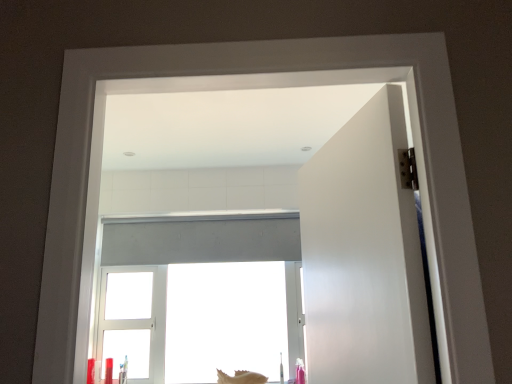
Find the location of a particular element. smooth beige seashell at lower center is located at coordinates (241, 377).

Describe the element at coordinates (365, 254) in the screenshot. I see `white matte door at right` at that location.

The image size is (512, 384). Find the location of `smooth beige seashell at lower center`. smooth beige seashell at lower center is located at coordinates (241, 377).

Is white matte window at center positioned far away from white matte door at right?

Yes, white matte window at center and white matte door at right are located far from each other.

From a real-world perspective, is white matte window at center located beneath white matte door at right?

Indeed, from a real-world perspective, white matte window at center is positioned beneath white matte door at right.

Which of these two, white matte window at center or white matte door at right, is wider?

white matte door at right is wider.

From the image's perspective, which is below, white matte window at center or white matte door at right?

white matte window at center.

Could you tell me if white matte door at right is turned towards white matte window at center?

No, white matte door at right does not turn towards white matte window at center.

Can you confirm if white matte door at right is bigger than white matte window at center?

Actually, white matte door at right might be smaller than white matte window at center.

The width and height of the screenshot is (512, 384). Identify the location of window below the white matte door at right (from a real-world perspective). (201, 239).

Which object is wider, white matte door at right or white matte window at center?

white matte door at right.

Consider the image. Who is more distant, white matte window at center or smooth beige seashell at lower center?

white matte window at center.

Can you confirm if white matte window at center is smaller than smooth beige seashell at lower center?

No, white matte window at center is not smaller than smooth beige seashell at lower center.

From the image's perspective, would you say white matte window at center is shown under smooth beige seashell at lower center?

No.

Is white matte door at right touching smooth beige seashell at lower center?

white matte door at right and smooth beige seashell at lower center are not in contact.

Could you tell me if white matte door at right is turned towards smooth beige seashell at lower center?

No.

Is smooth beige seashell at lower center located within white matte door at right?

No.

Is smooth beige seashell at lower center positioned beyond the bounds of white matte door at right?

Absolutely, smooth beige seashell at lower center is external to white matte door at right.

From the image's perspective, is smooth beige seashell at lower center located above white matte door at right?

No, from the image's perspective, smooth beige seashell at lower center is not above white matte door at right.

Considering the relative sizes of smooth beige seashell at lower center and white matte door at right in the image provided, is smooth beige seashell at lower center thinner than white matte door at right?

Yes, smooth beige seashell at lower center is thinner than white matte door at right.

From a real-world perspective, is smooth beige seashell at lower center over white matte door at right?

Actually, smooth beige seashell at lower center is physically below white matte door at right in the real world.

Are smooth beige seashell at lower center and white matte window at center making contact?

No, smooth beige seashell at lower center is not making contact with white matte window at center.

Does smooth beige seashell at lower center have a greater width compared to white matte window at center?

No, smooth beige seashell at lower center is not wider than white matte window at center.

Is smooth beige seashell at lower center positioned with its back to white matte window at center?

Yes.

What's the angular difference between smooth beige seashell at lower center and white matte window at center's facing directions?

smooth beige seashell at lower center and white matte window at center are facing 6.14 degrees away from each other.

You are a GUI agent. You are given a task and a screenshot of the screen. Output one action in this format:
    pyautogui.click(x=<x>, y=<y>)
    Task: Click on the door on the right side of white matte window at center
    Image resolution: width=512 pixels, height=384 pixels.
    Given the screenshot: What is the action you would take?
    pyautogui.click(x=365, y=254)

Identify the location of window behind the white matte door at right. Image resolution: width=512 pixels, height=384 pixels. click(x=201, y=239).

Based on their spatial positions, is white matte window at center or smooth beige seashell at lower center further from white matte door at right?

smooth beige seashell at lower center is further to white matte door at right.

Looking at the image, which one is located further to white matte window at center, white matte door at right or smooth beige seashell at lower center?

white matte door at right.

In the scene shown: Based on their spatial positions, is white matte window at center or white matte door at right further from smooth beige seashell at lower center?

white matte door at right is positioned further to the anchor smooth beige seashell at lower center.

Which object lies nearer to the anchor point smooth beige seashell at lower center, white matte door at right or white matte window at center?

The object closer to smooth beige seashell at lower center is white matte window at center.

Estimate the real-world distances between objects in this image. Which object is closer to white matte door at right, smooth beige seashell at lower center or white matte window at center?

white matte window at center lies closer to white matte door at right than the other object.

Considering their positions, is smooth beige seashell at lower center positioned closer to white matte window at center than white matte door at right?

smooth beige seashell at lower center lies closer to white matte window at center than the other object.

Where is `animal positioned between white matte door at right and white matte window at center from near to far`? The width and height of the screenshot is (512, 384). animal positioned between white matte door at right and white matte window at center from near to far is located at coordinates (241, 377).